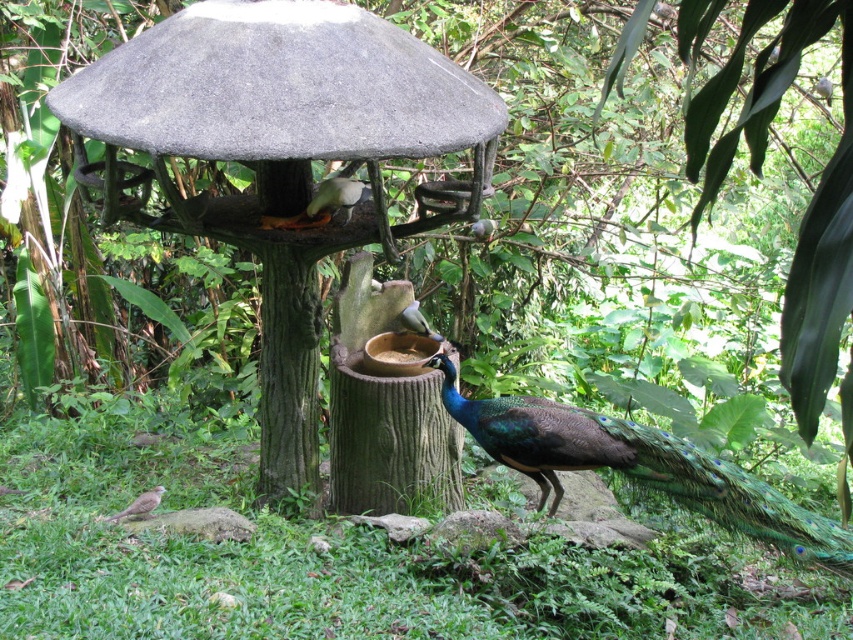
You are standing at the bird feeder structure and want to locate two points marked in the image. The first point is at coordinates point [730,496], and the second is at point [422,321]. Which point is closer to you?

Point [730,496] is in front of point [422,321], so it is closer to you.

You are a birdwatcher observing the scene. You notice a white glossy bird at upper center and a white matte bowl at center. Which object is wider?

The white glossy bird at upper center is wider than the white matte bowl at center.

You are a birdwatcher observing the scene. You notice the brown speckled bird at lower left and the white matte bowl at center. Which object is taller?

The white matte bowl at center is taller than the brown speckled bird at lower left.